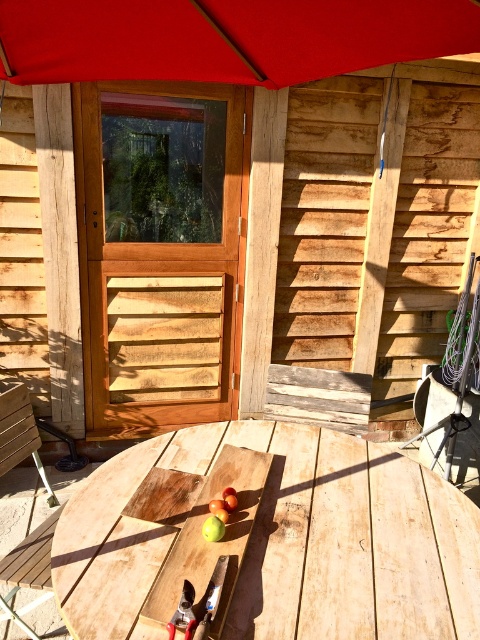
Can you confirm if wooden door at center is positioned below red fabric umbrella at upper center?

Yes.

Can you confirm if wooden door at center is bigger than red fabric umbrella at upper center?

Correct, wooden door at center is larger in size than red fabric umbrella at upper center.

Locate an element on the screen. This screenshot has height=640, width=480. wooden door at center is located at coordinates (229, 198).

At what (x,y) coordinates should I click in order to perform the action: click on wooden door at center. Please return your answer as a coordinate pair (x, y). Looking at the image, I should click on (229, 198).

The height and width of the screenshot is (640, 480). What do you see at coordinates (269, 538) in the screenshot?
I see `wooden at center` at bounding box center [269, 538].

Who is more distant from viewer, (x=155, y=636) or (x=9, y=392)?

The point (x=9, y=392) is behind.

The height and width of the screenshot is (640, 480). I want to click on wooden at center, so click(269, 538).

Based on the photo, who is more distant from viewer, (295,64) or (12,404)?

The point (12,404) is behind.

Who is positioned more to the right, wooden door at center or wooden bench at lower left?

wooden door at center

Which is behind, point (337, 83) or point (37, 531)?

The point (337, 83) is more distant.

The width and height of the screenshot is (480, 640). What are the coordinates of `wooden door at center` in the screenshot? It's located at (229, 198).